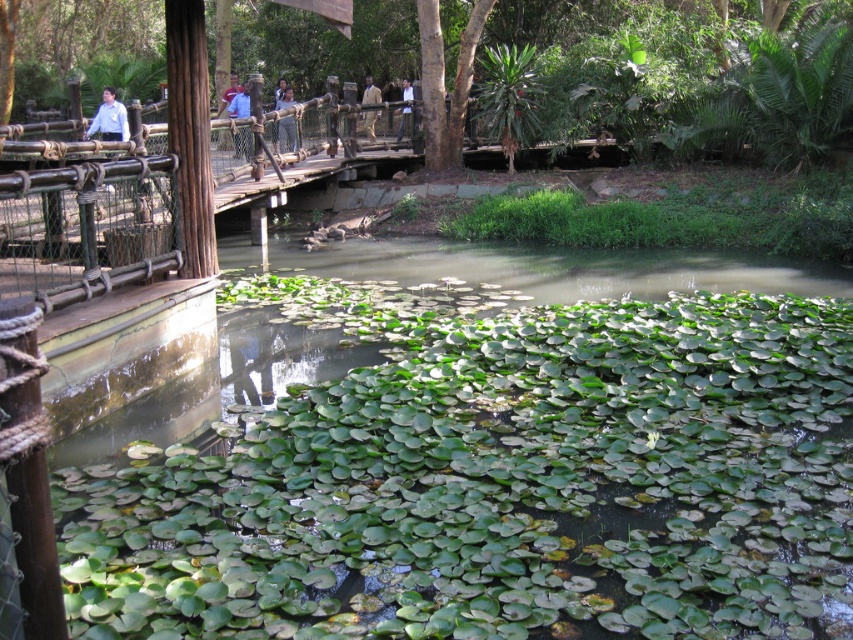
You are a photographer standing at the wooden bridge and you see two people wearing the light blue shirt at center and the white shirt at upper center. Which person should you focus on to capture a clearer image of their clothing details?

The light blue shirt at center has a larger size compared to the white shirt at upper center, so focusing on the light blue shirt at center would allow for clearer details due to its larger size.

You are a traveler who just arrived at this peaceful natural setting. You have two items with you, a light brown leather jacket at center and a blue fabric shirt at upper center. Which item takes up less space in your backpack?

The light brown leather jacket at center takes up less space in your backpack since it is smaller than the blue fabric shirt at upper center.

You are standing on the wooden bridge and notice a white shirt at upper left and a light brown wooden fence at center. Which object is closer to you from your current position on the bridge?

The white shirt at upper left is closer to you because it is in front of the light brown wooden fence at center.